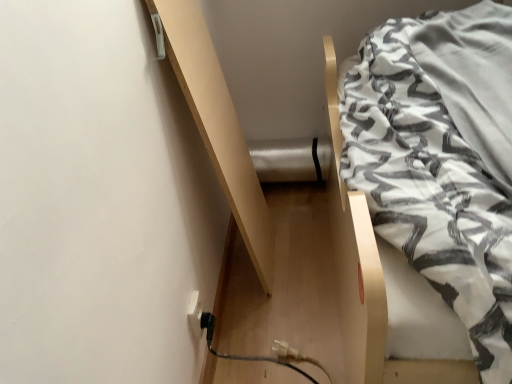
Locate an element on the screen. The width and height of the screenshot is (512, 384). light wood shelf at upper left is located at coordinates (218, 126).

What is the approximate height of white plastic electric outlet at lower left?

It is 4.94 inches.

This screenshot has height=384, width=512. I want to click on white textured fabric at upper right, so click(x=441, y=160).

The width and height of the screenshot is (512, 384). In order to click on light wood shelf at upper left in this screenshot , I will do `click(218, 126)`.

Can you confirm if white plastic electric outlet at lower left is taller than light wood shelf at upper left?

Incorrect, the height of white plastic electric outlet at lower left is not larger of that of light wood shelf at upper left.

Is white plastic electric outlet at lower left not near light wood shelf at upper left?

No.

Does white plastic electric outlet at lower left appear on the left side of light wood shelf at upper left?

Indeed, white plastic electric outlet at lower left is positioned on the left side of light wood shelf at upper left.

Locate an element on the screen. The image size is (512, 384). shelf above the white plastic electric outlet at lower left (from the image's perspective) is located at coordinates (218, 126).

Is light wood shelf at upper left situated inside white plastic electric outlet at lower left or outside?

light wood shelf at upper left is not enclosed by white plastic electric outlet at lower left.

Is light wood shelf at upper left positioned in front of white plastic electric outlet at lower left?

Yes.

Does white textured fabric at upper right come in front of light wood shelf at upper left?

Yes, it is.

Based on their sizes in the image, would you say white textured fabric at upper right is bigger or smaller than light wood shelf at upper left?

Considering their sizes, white textured fabric at upper right takes up more space than light wood shelf at upper left.

Is white textured fabric at upper right not near light wood shelf at upper left?

No, white textured fabric at upper right is not far away from light wood shelf at upper left.

The image size is (512, 384). What are the coordinates of `blanket in front of the white plastic electric outlet at lower left` in the screenshot? It's located at point(441,160).

In the scene shown: From the image's perspective, is white textured fabric at upper right under white plastic electric outlet at lower left?

No.

Is the position of white textured fabric at upper right less distant than that of white plastic electric outlet at lower left?

Yes, white textured fabric at upper right is closer to the camera.

From a real-world perspective, is white textured fabric at upper right above or below white plastic electric outlet at lower left?

From a real-world perspective, white textured fabric at upper right is physically above white plastic electric outlet at lower left.

Looking at this image, considering their positions, is light wood shelf at upper left located in front of or behind white textured fabric at upper right?

In the image, light wood shelf at upper left appears behind white textured fabric at upper right.

From a real-world perspective, does light wood shelf at upper left sit lower than white textured fabric at upper right?

No.

Is light wood shelf at upper left inside the boundaries of white textured fabric at upper right, or outside?

light wood shelf at upper left is spatially situated outside white textured fabric at upper right.

Is light wood shelf at upper left oriented away from white textured fabric at upper right?

No, light wood shelf at upper left is not facing away from white textured fabric at upper right.

In the scene shown: Is white plastic electric outlet at lower left beside white textured fabric at upper right?

They are not placed beside each other.

From the image's perspective, between white plastic electric outlet at lower left and white textured fabric at upper right, which one is located above?

From the image's view, white textured fabric at upper right is above.

Does white plastic electric outlet at lower left lie in front of white textured fabric at upper right?

No, the depth of white plastic electric outlet at lower left is greater than that of white textured fabric at upper right.

The image size is (512, 384). Find the location of `electric outlet behind the light wood shelf at upper left`. electric outlet behind the light wood shelf at upper left is located at coordinates (195, 314).

Locate an element on the screen. Image resolution: width=512 pixels, height=384 pixels. electric outlet below the light wood shelf at upper left (from the image's perspective) is located at coordinates click(x=195, y=314).

In the scene shown: From the image, which object appears to be farther from light wood shelf at upper left, white textured fabric at upper right or white plastic electric outlet at lower left?

white textured fabric at upper right is further to light wood shelf at upper left.

Looking at the image, which one is located closer to white plastic electric outlet at lower left, light wood shelf at upper left or white textured fabric at upper right?

The object closer to white plastic electric outlet at lower left is light wood shelf at upper left.

Estimate the real-world distances between objects in this image. Which object is closer to white plastic electric outlet at lower left, white textured fabric at upper right or light wood shelf at upper left?

Among the two, light wood shelf at upper left is located nearer to white plastic electric outlet at lower left.

Based on their spatial positions, is white plastic electric outlet at lower left or white textured fabric at upper right further from light wood shelf at upper left?

white textured fabric at upper right.

When comparing their distances from white textured fabric at upper right, does white plastic electric outlet at lower left or light wood shelf at upper left seem further?

white plastic electric outlet at lower left is further to white textured fabric at upper right.

Which object lies nearer to the anchor point white textured fabric at upper right, light wood shelf at upper left or white plastic electric outlet at lower left?

light wood shelf at upper left is positioned closer to the anchor white textured fabric at upper right.

Identify the location of shelf between white plastic electric outlet at lower left and white textured fabric at upper right from left to right. This screenshot has height=384, width=512. (218, 126).